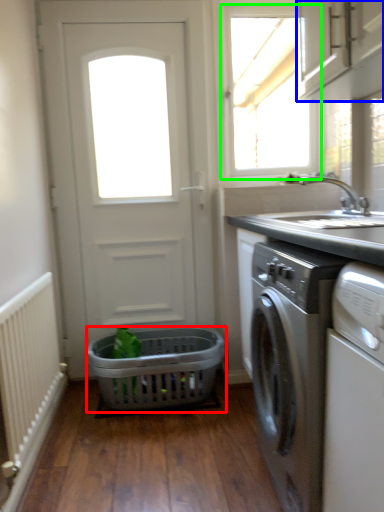
Question: Which object is positioned closest to basket (highlighted by a red box)? Select from cabinetry (highlighted by a blue box) and window (highlighted by a green box).

Choices:
 (A) cabinetry
 (B) window

Answer: (A)